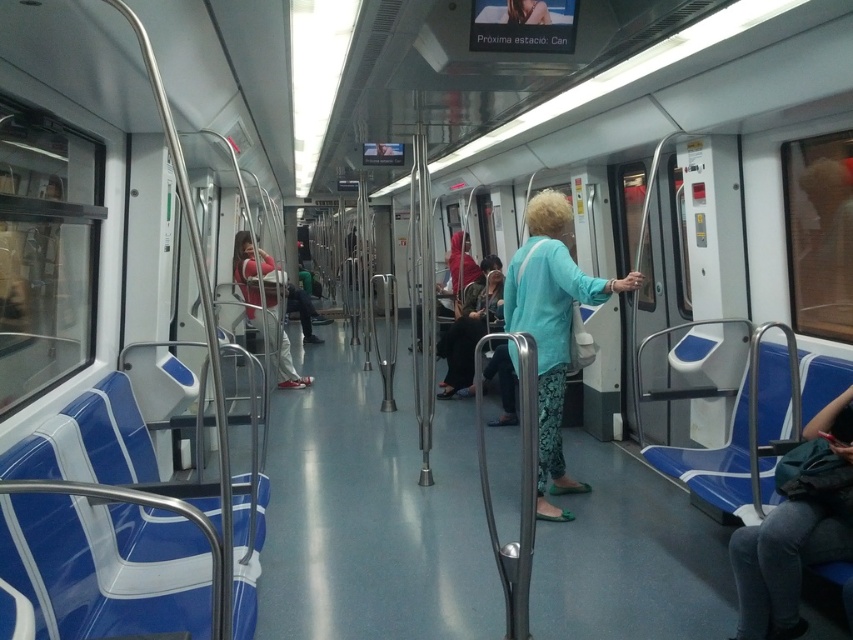
You are standing in the subway car and see both the light blue fabric jacket at center and the matte red shirt at center. Which one is closer to you?

The light blue fabric jacket at center is closer to you since it is in front of the matte red shirt at center.

You are standing in the subway train car and want to know where the dark gray jeans at lower right are located. Can you tell me their exact position using coordinates?

The dark gray jeans at lower right are located at coordinates point (x=795, y=531).

You are a passenger on the subway train and you want to know which item takes up more space. Which is larger between the dark gray jeans at lower right and the light blue fabric jacket at center?

The light blue fabric jacket at center is larger than the dark gray jeans at lower right.